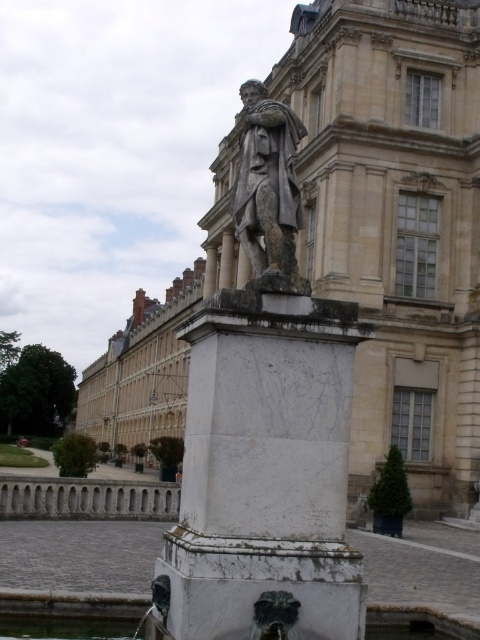
Does point (470, 118) lie behind point (263, 596)?

Yes.

Is point (417, 369) closer to camera compared to point (276, 419)?

No, (417, 369) is further to viewer.

At what (x,y) coordinates should I click in order to perform the action: click on marble statue at center. Please return your answer as a coordinate pair (x, y). Looking at the image, I should click on (396, 225).

Is marble statue at center closer to the viewer compared to gray stone statue at center?

No, it is behind gray stone statue at center.

Can you confirm if marble statue at center is bigger than gray stone statue at center?

Yes, marble statue at center is bigger than gray stone statue at center.

Is point (379, 456) closer to viewer compared to point (294, 257)?

No.

The image size is (480, 640). I want to click on marble statue at center, so click(x=396, y=225).

Which is behind, point (309, 632) or point (286, 134)?

The point (286, 134) is behind.

Measure the distance from white marble pedestal at center to gray stone statue at center.

The distance of white marble pedestal at center from gray stone statue at center is 5.37 meters.

Does point (267, 508) lie behind point (267, 205)?

No, it is not.

Find the location of a particular element. The width and height of the screenshot is (480, 640). white marble pedestal at center is located at coordinates (265, 474).